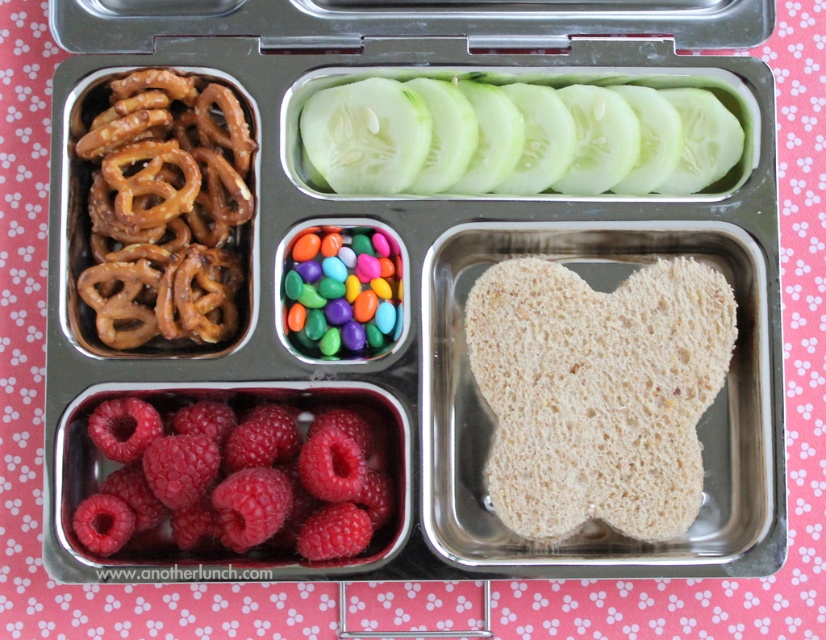
Question: Does matte brown pretzels at upper left appear under glossy multicolored candies at center?

Choices:
 (A) no
 (B) yes

Answer: (B)

Question: Is white bread at center wider than brown crunchy pretzels at left?

Choices:
 (A) yes
 (B) no

Answer: (A)

Question: Which object is closer to the camera taking this photo?

Choices:
 (A) glossy multicolored candies at center
 (B) matte brown pretzels at upper left

Answer: (B)

Question: Which of the following is the closest to the observer?

Choices:
 (A) matte brown pretzels at upper left
 (B) green smooth cucumber slices at upper center

Answer: (A)

Question: Which point is farther to the camera?

Choices:
 (A) bright red raspberry at bottom left
 (B) matte brown pretzels at upper left
 (C) white bread at center
 (D) glossy multicolored candies at center

Answer: (D)

Question: Can you confirm if white bread at center is positioned to the left of green smooth cucumber slices at upper center?

Choices:
 (A) no
 (B) yes

Answer: (A)